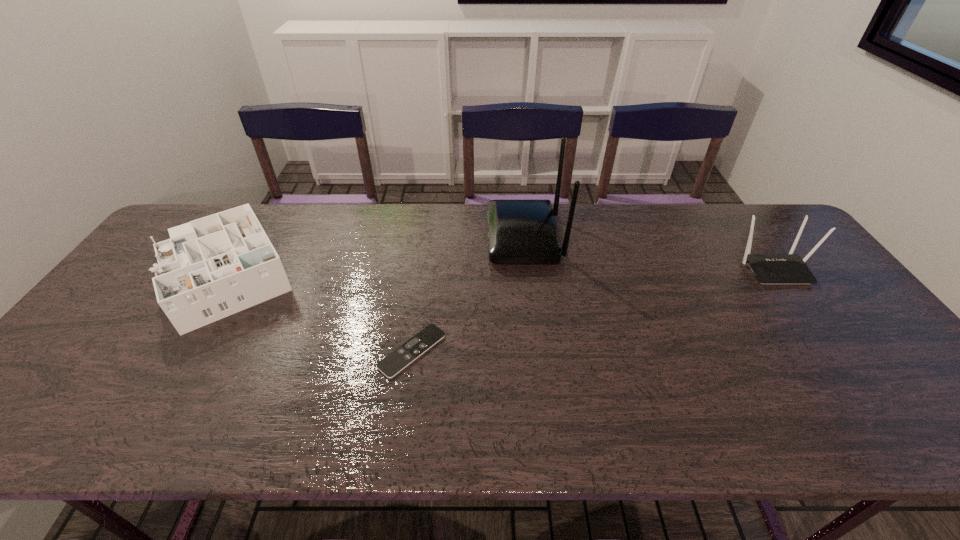
Image resolution: width=960 pixels, height=540 pixels. Identify the location of vacant space at the near edge. (832, 410).

At what (x,y) coordinates should I click in order to perform the action: click on blank space at the left edge of the desktop. Please return your answer as a coordinate pair (x, y). The image size is (960, 540). Looking at the image, I should click on (145, 282).

I want to click on vacant space at the right edge of the desktop, so click(x=831, y=306).

At what (x,y) coordinates should I click in order to perform the action: click on blank space at the near left corner. Please return your answer as a coordinate pair (x, y). This screenshot has height=540, width=960. Looking at the image, I should click on (12, 442).

This screenshot has width=960, height=540. What are the coordinates of `empty location between the right router and the dollhouse` in the screenshot? It's located at (497, 269).

This screenshot has height=540, width=960. In order to click on free spot between the right router and the taller router in this screenshot , I will do `click(649, 253)`.

Locate an element on the screen. empty location between the third object from left to right and the right router is located at coordinates (649, 253).

You are a GUI agent. You are given a task and a screenshot of the screen. Output one action in this format:
    pyautogui.click(x=<x>, y=<y>)
    Task: Click on the free space between the third object from left to right and the shorter router
    
    Given the screenshot: What is the action you would take?
    pyautogui.click(x=649, y=253)

You are a GUI agent. You are given a task and a screenshot of the screen. Output one action in this format:
    pyautogui.click(x=<x>, y=<y>)
    Task: Click on the blank region between the third object from left to right and the shorter router
    The width and height of the screenshot is (960, 540).
    Given the screenshot: What is the action you would take?
    pyautogui.click(x=649, y=253)

I want to click on vacant area that lies between the right router and the remote control, so click(592, 309).